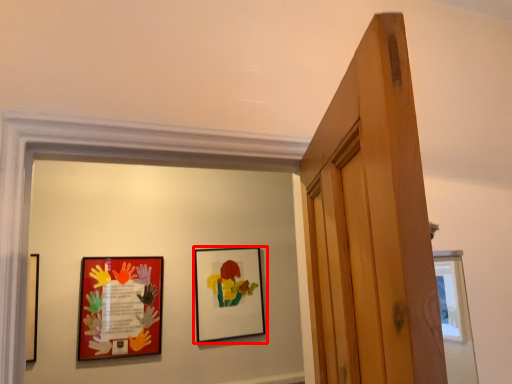
Question: In this image, where is picture frame (annotated by the red box) located relative to picture frame?

Choices:
 (A) left
 (B) right

Answer: (B)